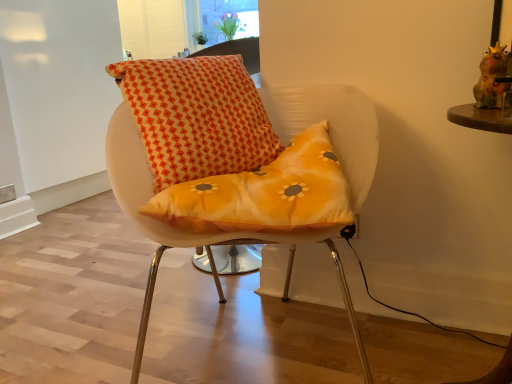
Question: From a real-world perspective, is matte orange cushion at center positioned above or below transparent glass window at upper center?

Choices:
 (A) above
 (B) below

Answer: (B)

Question: Is matte orange cushion at center wider or thinner than transparent glass window at upper center?

Choices:
 (A) wide
 (B) thin

Answer: (A)

Question: Which object is positioned closest to the matte orange cushion at center?

Choices:
 (A) brown wooden table at right
 (B) transparent glass window at upper center
 (C) orange printed cushion at upper center

Answer: (C)

Question: Considering the real-world distances, which object is closest to the matte orange cushion at center?

Choices:
 (A) brown wooden table at right
 (B) transparent glass window at upper center
 (C) orange printed cushion at upper center

Answer: (C)